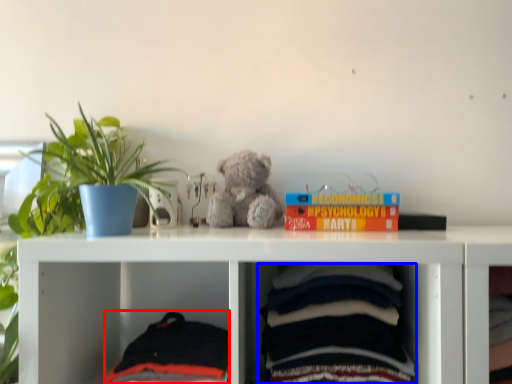
Question: Which of the following is the farthest to the observer, baby clothe (highlighted by a red box) or baby clothe (highlighted by a blue box)?

Choices:
 (A) baby clothe
 (B) baby clothe

Answer: (A)